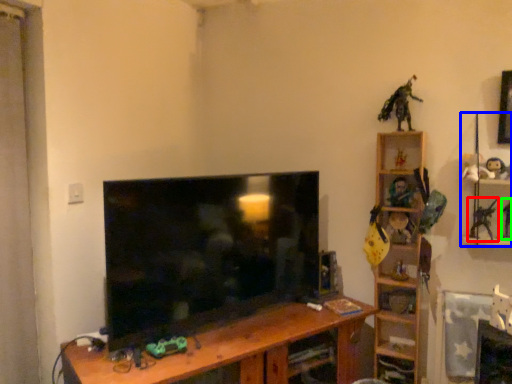
Question: Based on their relative distances, which object is nearer to toy (highlighted by a red box)? Choose from toy (highlighted by a blue box) and toy (highlighted by a green box).

Choices:
 (A) toy
 (B) toy

Answer: (A)